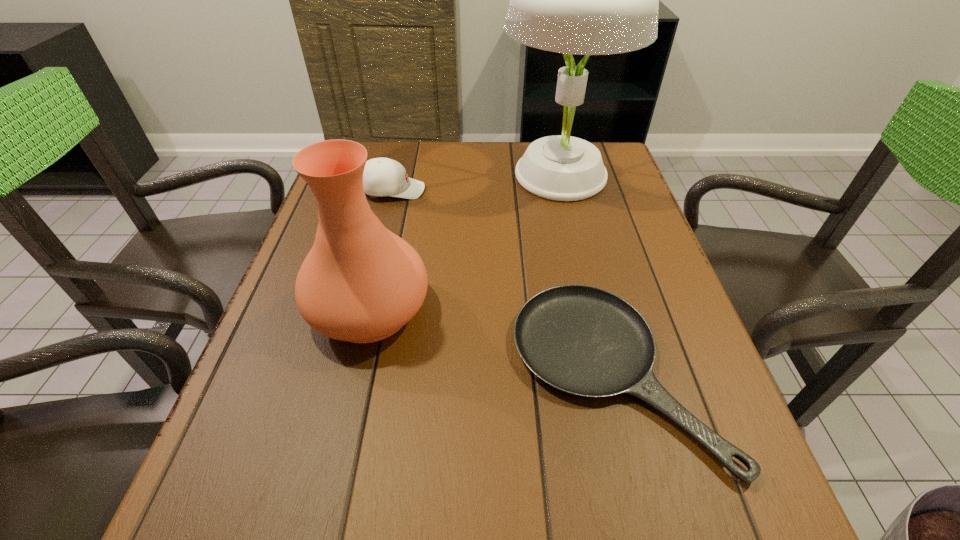
At what (x,y) coordinates should I click in order to perform the action: click on lamp situated at the far edge. Please return your answer as a coordinate pair (x, y). Looking at the image, I should click on (x=587, y=0).

At what (x,y) coordinates should I click in order to perform the action: click on baseball cap that is at the far edge. Please return your answer as a coordinate pair (x, y). Looking at the image, I should click on pyautogui.click(x=382, y=176).

Where is `vase at the left edge`? vase at the left edge is located at coordinates (361, 283).

This screenshot has width=960, height=540. In order to click on baseball cap present at the left edge in this screenshot , I will do `click(382, 176)`.

You are a GUI agent. You are given a task and a screenshot of the screen. Output one action in this format:
    pyautogui.click(x=<x>, y=<y>)
    Task: Click on the lamp positioned at the right edge
    This screenshot has height=540, width=960.
    Given the screenshot: What is the action you would take?
    pyautogui.click(x=587, y=0)

The height and width of the screenshot is (540, 960). Identify the location of frying pan located in the right edge section of the desktop. (582, 340).

Identify the location of object present at the far left corner. Image resolution: width=960 pixels, height=540 pixels. (382, 176).

Locate an element on the screen. object at the far right corner is located at coordinates (587, 0).

This screenshot has width=960, height=540. Find the location of `blank space at the far edge of the desktop`. blank space at the far edge of the desktop is located at coordinates (455, 179).

At what (x,y) coordinates should I click in order to perform the action: click on vacant space at the near edge. Please return your answer as a coordinate pair (x, y). Looking at the image, I should click on (642, 536).